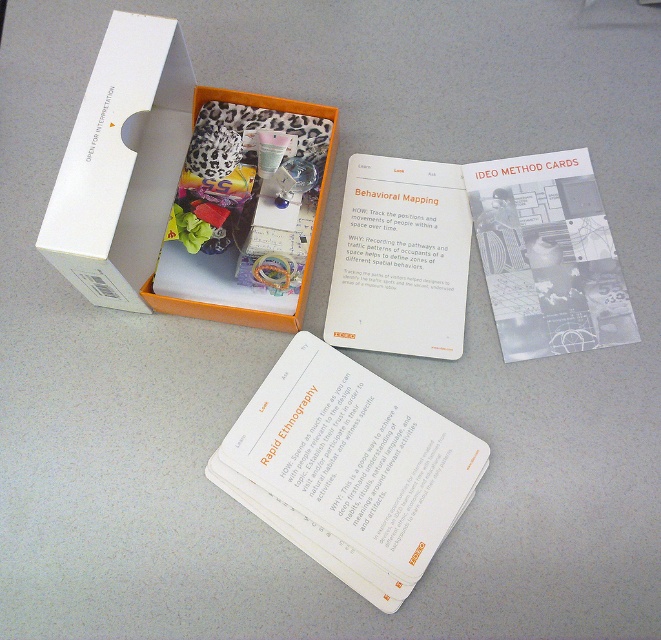
You are organizing a design thinking workshop and need to store the white paper cards at center and the white cardboard box at upper left. Which container can hold both items without overlapping?

The white cardboard box at upper left is larger than the white paper cards at center, so it can hold both items without overlapping.

Where are the white paper cards at center located in the image?

The white paper cards at center are located at the point with coordinates 0.733 in the x axis and 0.530 in the y axis.